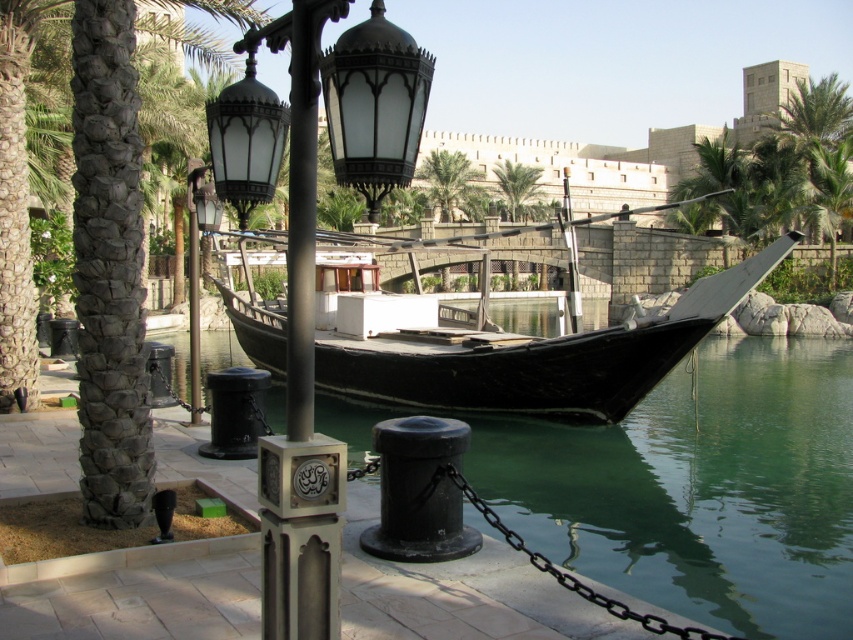
You are a city planner assessing the waterfront area. You need to install a new bench that is 1.5 meters wide. The bench must be placed between the polished metal street light at center and the green leafy palm tree at center. Given their widths, can the bench fit without overlapping either object?

The polished metal street light at center has a lesser width compared to the green leafy palm tree at center. Since the street light is narrower, the total space between them may accommodate the 1.5 meter bench, but exact placement depends on their combined widths. However, since the description only states the street light is narrower, we cannot definitively confirm without knowing the exact widths of both objects.

You are a tour guide leading a group to the black polished wood boat at center. You need to move from the walkway to the boat. The path between the green water at boat right and the boat is 3.05 meters. Is this path wide enough for a 2.5 meter wide tour cart to pass through?

The path between the green water at boat right and the black polished wood boat at center is 3.05 meters wide. Since the tour cart is 2.5 meters wide, it can pass through the path as the width is sufficient.